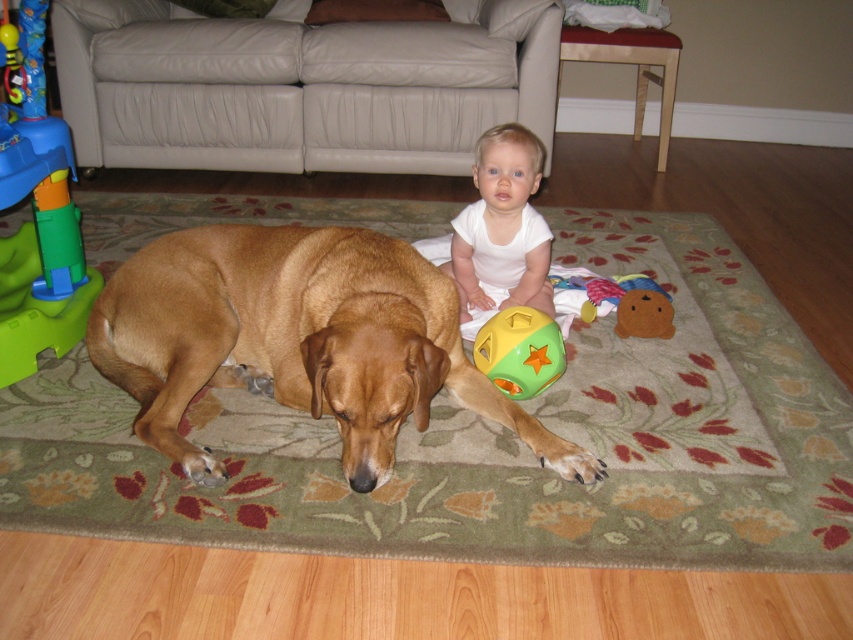
You are a guest entering the living room and want to sit on the beige leather couch at upper center. However, there is a soft plush bear at center in your way. Can you move the bear to reach the couch?

The soft plush bear at center is behind the beige leather couch at upper center, so you don t need to move it to sit on the couch.

You are a parent standing in the room and want to hand the green rubber ball at center to your baby who is sitting on the rug. Can you reach the ball without moving from your current position?

The green rubber ball at center is 6.10 feet away from viewer, so you cannot reach it without moving closer.